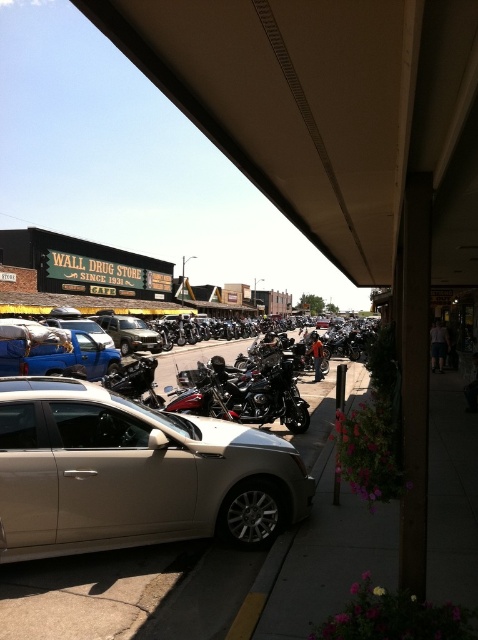
You are a tour guide explaining the parking arrangement to visitors. You mention the satin silver sedan at center and the shiny chrome motorcycle at center. Which one is closer to the flower basket hanging from the awning on the right?

The shiny chrome motorcycle at center is closer to the flower basket hanging from the awning on the right because the satin silver sedan at center is positioned on its left side.

You are a delivery person who needs to load a package onto the roof of the satin silver sedan at center and the shiny chrome motorcycle at center. Which vehicle will require you to step onto a ladder to reach its roof?

The satin silver sedan at center has a greater height compared to shiny chrome motorcycle at center, so you will need to step onto a ladder to reach the roof of the satin silver sedan at center.